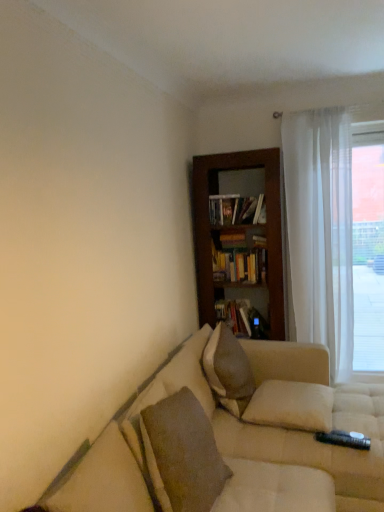
Identify the location of white soft pillow at center, the 2th pillow when ordered from front to back. The image size is (384, 512). (291, 406).

Describe the element at coordinates (235, 315) in the screenshot. Image resolution: width=384 pixels, height=512 pixels. I see `hardcover book at center, the second book in the top-to-bottom sequence` at that location.

What is the approximate height of white sheer curtain at right?

white sheer curtain at right is 2.12 meters tall.

What is the approximate width of hardcover books at center, arranged as the 2th book when ordered from the bottom?

hardcover books at center, arranged as the 2th book when ordered from the bottom, is 7.61 inches in width.

Identify the location of textured beige pillow at center, the first pillow from the back. The width and height of the screenshot is (384, 512). (228, 370).

Between hardcover book at center, positioned as the 1th book in bottom-to-top order, and textured beige pillow at lower left, arranged as the third pillow when viewed from the back, which one has smaller size?

Smaller between the two is hardcover book at center, positioned as the 1th book in bottom-to-top order.

How much distance is there between hardcover book at center, positioned as the 1th book in bottom-to-top order, and textured beige pillow at lower left, the 1th pillow positioned from the front?

hardcover book at center, positioned as the 1th book in bottom-to-top order, is 1.56 meters away from textured beige pillow at lower left, the 1th pillow positioned from the front.

Are hardcover book at center, the second book in the top-to-bottom sequence, and textured beige pillow at lower left, arranged as the third pillow when viewed from the back, beside each other?

No, hardcover book at center, the second book in the top-to-bottom sequence, is not with textured beige pillow at lower left, arranged as the third pillow when viewed from the back.

Locate an element on the screen. The height and width of the screenshot is (512, 384). bookcase on the left side of white sheer curtain at right is located at coordinates tap(239, 234).

Can you confirm if white sheer curtain at right is positioned to the right of wooden bookshelf at center?

Correct, you'll find white sheer curtain at right to the right of wooden bookshelf at center.

Does white sheer curtain at right have a greater width compared to wooden bookshelf at center?

Incorrect, the width of white sheer curtain at right does not surpass that of wooden bookshelf at center.

Is point (323, 225) farther from camera compared to point (260, 251)?

No, (323, 225) is closer to viewer.

Between beige fabric couch at lower right and hardcover book at center, positioned as the 1th book in bottom-to-top order, which one has larger width?

Wider between the two is beige fabric couch at lower right.

Is beige fabric couch at lower right bigger than hardcover book at center, positioned as the 1th book in bottom-to-top order?

Indeed, beige fabric couch at lower right has a larger size compared to hardcover book at center, positioned as the 1th book in bottom-to-top order.

Locate an element on the screen. studio couch lying on the right of hardcover book at center, the second book in the top-to-bottom sequence is located at coordinates (236, 437).

Is textured beige pillow at center, the first pillow from the back, far away from hardcover book at center, positioned as the 1th book in bottom-to-top order?

No, textured beige pillow at center, the first pillow from the back, is in close proximity to hardcover book at center, positioned as the 1th book in bottom-to-top order.

Which is behind, point (219, 365) or point (246, 315)?

The point (246, 315) is farther from the camera.

Does textured beige pillow at center, which is counted as the third pillow, starting from the front, have a greater height compared to hardcover book at center, positioned as the 1th book in bottom-to-top order?

Yes.

Is hardcover book at center, the second book in the top-to-bottom sequence, located within textured beige pillow at center, which is counted as the third pillow, starting from the front?

No, hardcover book at center, the second book in the top-to-bottom sequence, is located outside of textured beige pillow at center, which is counted as the third pillow, starting from the front.

What's the angular difference between hardcover books at center, which appears as the first book when viewed from the top, and transparent curtain at right's facing directions?

There is a 2.39-degree angle between the facing directions of hardcover books at center, which appears as the first book when viewed from the top, and transparent curtain at right.

Image resolution: width=384 pixels, height=512 pixels. What are the coordinates of `book that is the 2nd object located in front of the transparent curtain at right` in the screenshot? It's located at (239, 266).

Is hardcover books at center, arranged as the 2th book when ordered from the bottom, inside or outside of transparent curtain at right?

hardcover books at center, arranged as the 2th book when ordered from the bottom, is not inside transparent curtain at right, it's outside.

Between point (255, 267) and point (339, 190), which one is positioned behind?

Positioned behind is point (255, 267).

Does white sheer curtain at right have a larger size compared to textured beige pillow at center, which is counted as the third pillow, starting from the front?

Yes, white sheer curtain at right is bigger than textured beige pillow at center, which is counted as the third pillow, starting from the front.

From a real-world perspective, is white sheer curtain at right positioned under textured beige pillow at center, which is counted as the third pillow, starting from the front, based on gravity?

No, from a real-world perspective, white sheer curtain at right is not below textured beige pillow at center, which is counted as the third pillow, starting from the front.

Which is in front, point (296, 266) or point (212, 340)?

Positioned in front is point (212, 340).

Which of these two, white sheer curtain at right or textured beige pillow at center, which is counted as the third pillow, starting from the front, stands shorter?

With less height is textured beige pillow at center, which is counted as the third pillow, starting from the front.

Considering the positions of objects wooden bookshelf at center and textured beige pillow at center, the first pillow from the back, in the image provided, who is behind, wooden bookshelf at center or textured beige pillow at center, the first pillow from the back,?

wooden bookshelf at center is more distant.

Is wooden bookshelf at center touching textured beige pillow at center, which is counted as the third pillow, starting from the front?

wooden bookshelf at center and textured beige pillow at center, which is counted as the third pillow, starting from the front, are not in contact.

Does wooden bookshelf at center have a lesser width compared to textured beige pillow at center, the first pillow from the back?

No.

Is wooden bookshelf at center taller than textured beige pillow at center, the first pillow from the back?

Yes, wooden bookshelf at center is taller than textured beige pillow at center, the first pillow from the back.

At what (x,y) coordinates should I click in order to perform the action: click on pillow that is the 3rd one when counting forward from the hardcover book at center, positioned as the 1th book in bottom-to-top order. Please return your answer as a coordinate pair (x, y). Looking at the image, I should click on (x=182, y=454).

Where is `curtain located below the wooden bookshelf at center (from the image's perspective)`? This screenshot has width=384, height=512. curtain located below the wooden bookshelf at center (from the image's perspective) is located at coordinates (320, 231).

Based on their spatial positions, is textured beige pillow at center, the first pillow from the back, or beige fabric couch at lower right closer to textured beige pillow at lower left, the 1th pillow positioned from the front?

beige fabric couch at lower right.

From the image, which object appears to be nearer to white soft pillow at center, the 2th pillow when ordered from front to back, hardcover book at center, positioned as the 1th book in bottom-to-top order, or wooden bookshelf at center?

hardcover book at center, positioned as the 1th book in bottom-to-top order, is closer to white soft pillow at center, the 2th pillow when ordered from front to back.

When comparing their distances from hardcover books at center, which appears as the first book when viewed from the top, does white soft pillow at center, the 2th pillow when ordered from front to back, or beige fabric couch at lower right seem further?

beige fabric couch at lower right.

When comparing their distances from hardcover book at center, the second book in the top-to-bottom sequence, does transparent curtain at right or white soft pillow at center, the second pillow when ordered from back to front, seem closer?

transparent curtain at right is positioned closer to the anchor hardcover book at center, the second book in the top-to-bottom sequence.

Estimate the real-world distances between objects in this image. Which object is further from white soft pillow at center, the 2th pillow when ordered from front to back, transparent curtain at right or textured beige pillow at center, which is counted as the third pillow, starting from the front?

transparent curtain at right lies further to white soft pillow at center, the 2th pillow when ordered from front to back, than the other object.

When comparing their distances from white soft pillow at center, the 2th pillow when ordered from front to back, does hardcover book at center, the second book in the top-to-bottom sequence, or textured beige pillow at center, the first pillow from the back, seem closer?

textured beige pillow at center, the first pillow from the back, lies closer to white soft pillow at center, the 2th pillow when ordered from front to back, than the other object.

When comparing their distances from wooden bookshelf at center, does textured beige pillow at lower left, arranged as the third pillow when viewed from the back, or beige fabric couch at lower right seem further?

textured beige pillow at lower left, arranged as the third pillow when viewed from the back, is positioned further to the anchor wooden bookshelf at center.

From the image, which object appears to be nearer to textured beige pillow at lower left, the 1th pillow positioned from the front, wooden bookshelf at center or white sheer curtain at right?

wooden bookshelf at center.

You are a GUI agent. You are given a task and a screenshot of the screen. Output one action in this format:
    pyautogui.click(x=<x>, y=<y>)
    Task: Click on the book between textured beige pillow at lower left, the 1th pillow positioned from the front, and hardcover book at center, the second book in the top-to-bottom sequence, from front to back
    This screenshot has width=384, height=512.
    Given the screenshot: What is the action you would take?
    pyautogui.click(x=239, y=266)

Locate an element on the screen. book situated between hardcover book at center, positioned as the 1th book in bottom-to-top order, and white sheer curtain at right from left to right is located at coordinates (239, 266).

The image size is (384, 512). I want to click on bookcase between textured beige pillow at lower left, arranged as the third pillow when viewed from the back, and hardcover book at center, the second book in the top-to-bottom sequence, in the front-back direction, so click(x=239, y=234).

Where is `curtain between white soft pillow at center, the 2th pillow when ordered from front to back, and hardcover books at center, which appears as the first book when viewed from the top, from front to back`? The height and width of the screenshot is (512, 384). curtain between white soft pillow at center, the 2th pillow when ordered from front to back, and hardcover books at center, which appears as the first book when viewed from the top, from front to back is located at coordinates (320, 231).